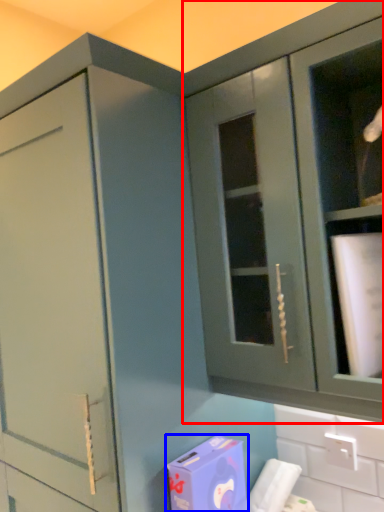
Question: Which object appears farthest to the camera in this image, cabinetry (highlighted by a red box) or cardboard box (highlighted by a blue box)?

Choices:
 (A) cabinetry
 (B) cardboard box

Answer: (B)